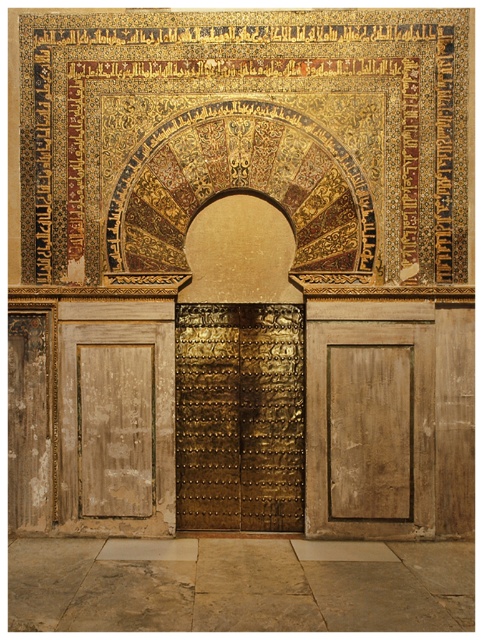
Question: Which point is farther from the camera taking this photo?

Choices:
 (A) tap(273, 356)
 (B) tap(203, 122)
 (C) tap(312, 374)
 (D) tap(122, 228)

Answer: (A)

Question: Considering the real-world distances, which object is farthest from the gold mosaic at upper center?

Choices:
 (A) gold textured door at center
 (B) wooden panel at center
 (C) gold textured archway at center

Answer: (B)

Question: Does gold mosaic at upper center lie behind gold textured archway at center?

Choices:
 (A) no
 (B) yes

Answer: (B)

Question: Among these objects, which one is farthest from the camera?

Choices:
 (A) wooden panel at left
 (B) gold textured door at center
 (C) gold mosaic at upper center

Answer: (B)

Question: Observing the image, what is the correct spatial positioning of gold mosaic at upper center in reference to wooden panel at left?

Choices:
 (A) right
 (B) left

Answer: (A)

Question: Is gold mosaic at upper center closer to camera compared to gold textured door at center?

Choices:
 (A) yes
 (B) no

Answer: (A)